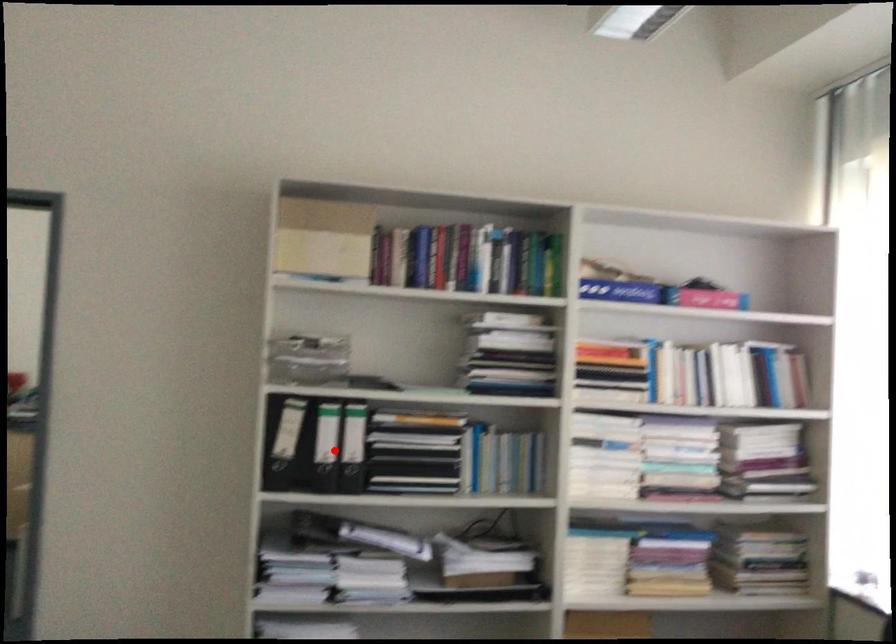
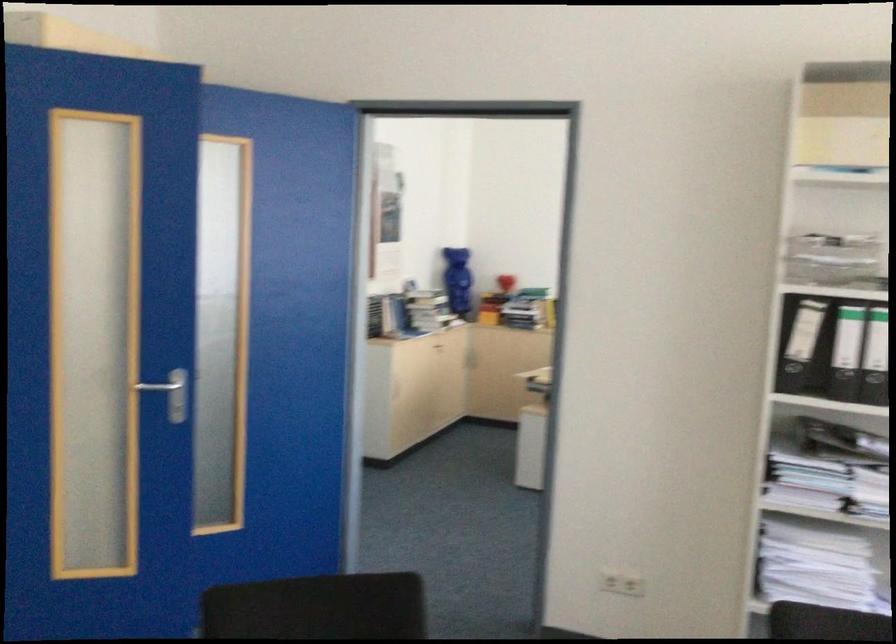
Where in the second image is the point corresponding to the highlighted location from the first image?

(858, 355)